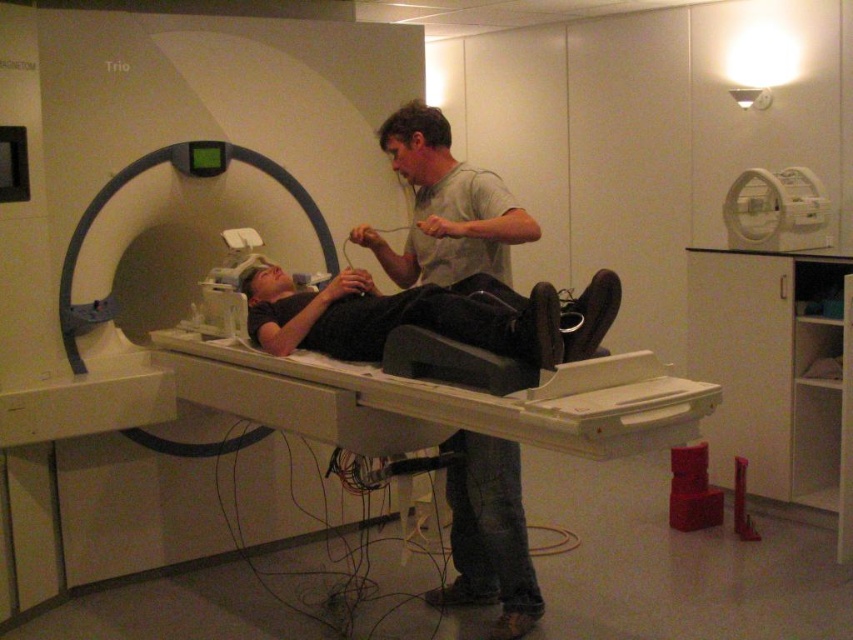
Which is more to the right, gray cotton shirt at center or black matte patient at center?

Positioned to the right is gray cotton shirt at center.

Who is more forward, (448, 128) or (450, 312)?

Point (450, 312) is in front.

Where is `gray cotton shirt at center`? gray cotton shirt at center is located at coordinates (445, 209).

Can you confirm if black matte patient at center is positioned to the right of white plastic scanner at upper right?

Incorrect, black matte patient at center is not on the right side of white plastic scanner at upper right.

Does black matte patient at center have a greater height compared to white plastic scanner at upper right?

No, black matte patient at center is not taller than white plastic scanner at upper right.

Is point (329, 333) positioned before point (735, 243)?

Yes, point (329, 333) is in front of point (735, 243).

In order to click on black matte patient at center in this screenshot , I will do `click(392, 316)`.

Between matte black mri bed at center and white plastic scanner at upper right, which one appears on the left side from the viewer's perspective?

matte black mri bed at center

Does matte black mri bed at center have a lesser width compared to white plastic scanner at upper right?

Incorrect, matte black mri bed at center's width is not less than white plastic scanner at upper right's.

Between point (321, 301) and point (822, 248), which one is positioned behind?

Point (822, 248)

I want to click on matte black mri bed at center, so click(434, 332).